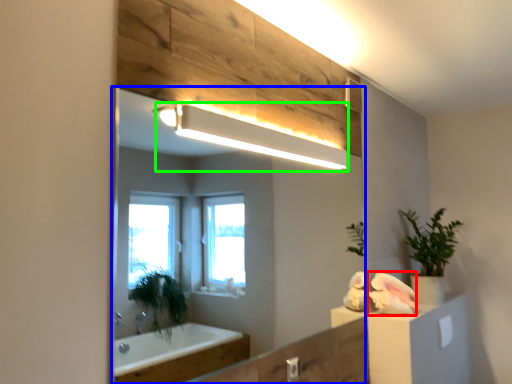
Question: Considering the real-world distances, which object is closest to animal (highlighted by a red box)? mirror (highlighted by a blue box) or light fixture (highlighted by a green box).

Choices:
 (A) mirror
 (B) light fixture

Answer: (B)